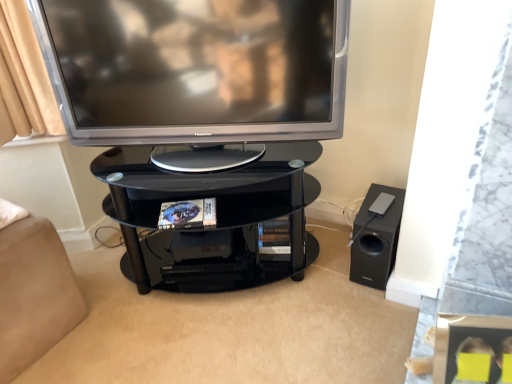
Image resolution: width=512 pixels, height=384 pixels. Identify the location of free space between black matte speaker at lower right and black glass shelf at center. (336, 256).